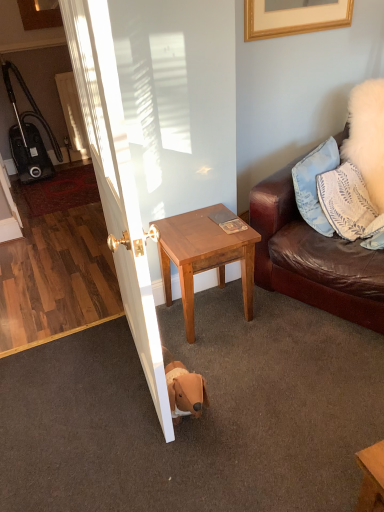
Question: Is light brown wood side table at center facing towards black plastic vacuum cleaner at left?

Choices:
 (A) no
 (B) yes

Answer: (A)

Question: Is light brown wood side table at center bigger than black plastic vacuum cleaner at left?

Choices:
 (A) no
 (B) yes

Answer: (A)

Question: Considering the relative positions of light brown wood side table at center and black plastic vacuum cleaner at left in the image provided, is light brown wood side table at center to the left of black plastic vacuum cleaner at left from the viewer's perspective?

Choices:
 (A) no
 (B) yes

Answer: (A)

Question: Considering the relative positions of light brown wood side table at center and black plastic vacuum cleaner at left in the image provided, is light brown wood side table at center to the right of black plastic vacuum cleaner at left from the viewer's perspective?

Choices:
 (A) yes
 (B) no

Answer: (A)

Question: Is light brown wood side table at center smaller than black plastic vacuum cleaner at left?

Choices:
 (A) yes
 (B) no

Answer: (A)

Question: Is light brown wood side table at center taller than black plastic vacuum cleaner at left?

Choices:
 (A) yes
 (B) no

Answer: (B)

Question: Is light brown wood side table at center at the left side of white glossy door at center?

Choices:
 (A) no
 (B) yes

Answer: (A)

Question: Considering the relative sizes of light brown wood side table at center and white glossy door at center in the image provided, is light brown wood side table at center bigger than white glossy door at center?

Choices:
 (A) no
 (B) yes

Answer: (A)

Question: Is light brown wood side table at center facing away from white glossy door at center?

Choices:
 (A) no
 (B) yes

Answer: (A)

Question: Is light brown wood side table at center shorter than white glossy door at center?

Choices:
 (A) yes
 (B) no

Answer: (A)

Question: Does light brown wood side table at center have a smaller size compared to white glossy door at center?

Choices:
 (A) no
 (B) yes

Answer: (B)

Question: Can you confirm if light brown wood side table at center is wider than white glossy door at center?

Choices:
 (A) no
 (B) yes

Answer: (A)

Question: Does black plastic vacuum cleaner at left lie behind white glossy door at center?

Choices:
 (A) no
 (B) yes

Answer: (B)